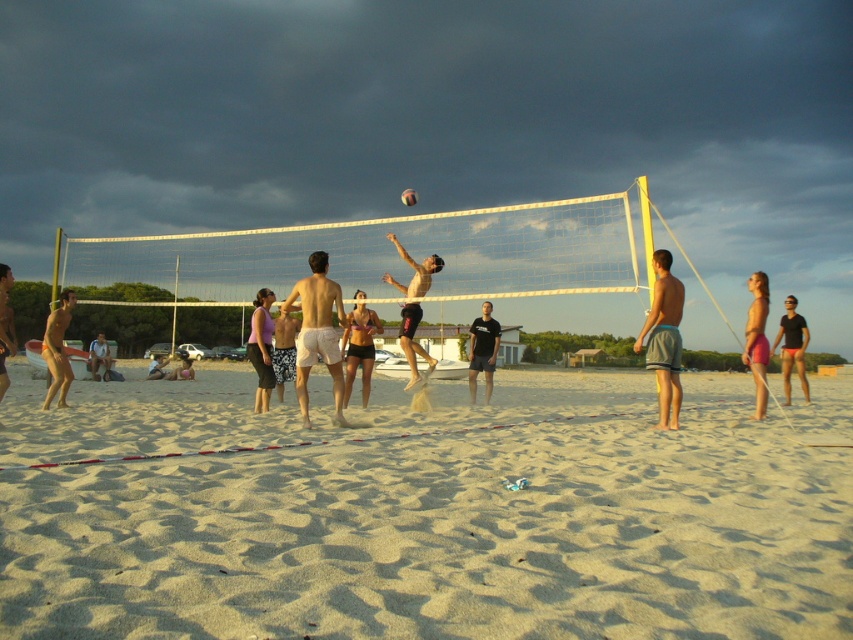
You are a photographer at the beach volleyball court. You want to capture a closeup shot of the matte skin at lower left and the white textured shorts at center. Which object should you zoom in on first to ensure both are in focus?

The matte skin at lower left is larger in size compared to the white textured shorts at center, so you should zoom in on the matte skin at lower left first to ensure both are in focus.

You are a spectator at the beach volleyball game and want to buy shorts similar to those worn by the players. You prefer shorts that are larger in size. Which shorts should you choose between the black fabric shorts at right and the smooth beige shorts at center?

The black fabric shorts at right has a larger size compared to the smooth beige shorts at center, so you should choose the black fabric shorts at right.